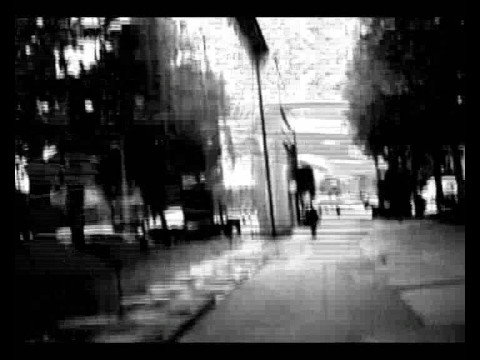
At what (x,y) coordinates should I click in order to perform the action: click on benches. Please return your answer as a coordinate pair (x, y). Looking at the image, I should click on (196, 228).